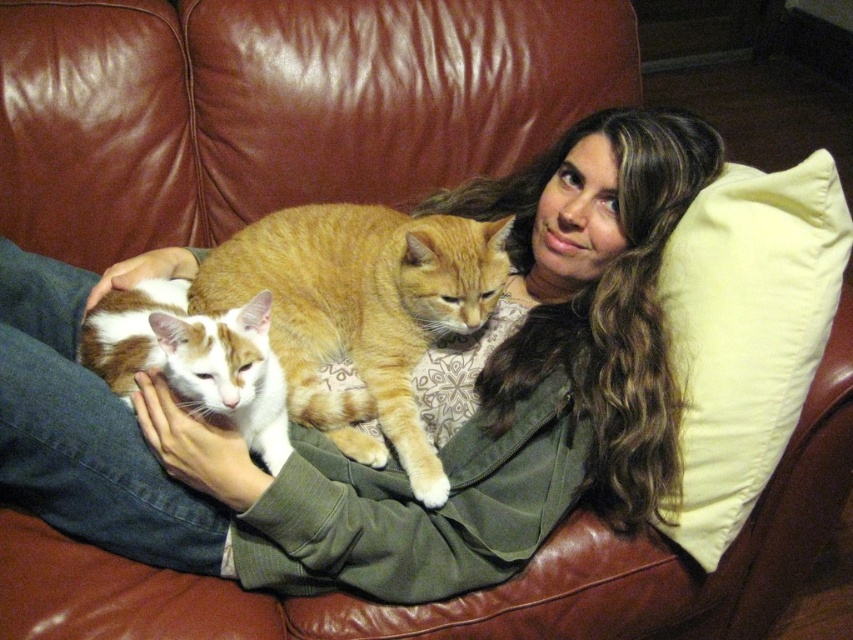
Is white fabric pillow at right smaller than orange tabby cat at center?

Yes.

You are a GUI agent. You are given a task and a screenshot of the screen. Output one action in this format:
    pyautogui.click(x=<x>, y=<y>)
    Task: Click on the white fabric pillow at right
    The image size is (853, 640).
    Given the screenshot: What is the action you would take?
    pyautogui.click(x=747, y=332)

Is point (775, 428) positioned after point (369, 400)?

That is False.

Where is `white fabric pillow at right`? white fabric pillow at right is located at coordinates (747, 332).

Describe the element at coordinates (361, 314) in the screenshot. I see `orange tabby cat at center` at that location.

Does orange tabby cat at center have a larger size compared to white and orange fur cat at center?

Indeed, orange tabby cat at center has a larger size compared to white and orange fur cat at center.

Who is more distant from viewer, [437,241] or [276,464]?

The point [437,241] is more distant.

In order to click on orange tabby cat at center in this screenshot , I will do pos(361,314).

Does white fabric pillow at right have a larger size compared to white and orange fur cat at center?

No.

Can you confirm if white fabric pillow at right is wider than white and orange fur cat at center?

In fact, white fabric pillow at right might be narrower than white and orange fur cat at center.

Is point (743, 268) positioned behind point (178, 284)?

No, it is in front of (178, 284).

The image size is (853, 640). I want to click on white fabric pillow at right, so click(747, 332).